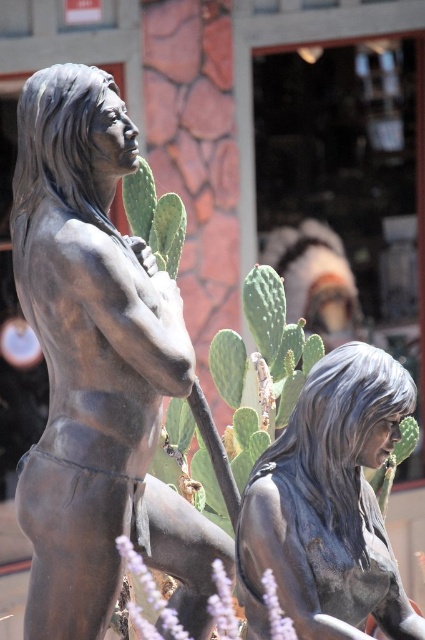
Does point (57, 449) come closer to viewer compared to point (309, 564)?

That is False.

Is the position of bronze statue at left more distant than that of shiny bronze statue at center?

Yes.

Who is more forward, (61, 154) or (339, 595)?

Positioned in front is point (339, 595).

Where is `bronze statue at left`? bronze statue at left is located at coordinates (96, 369).